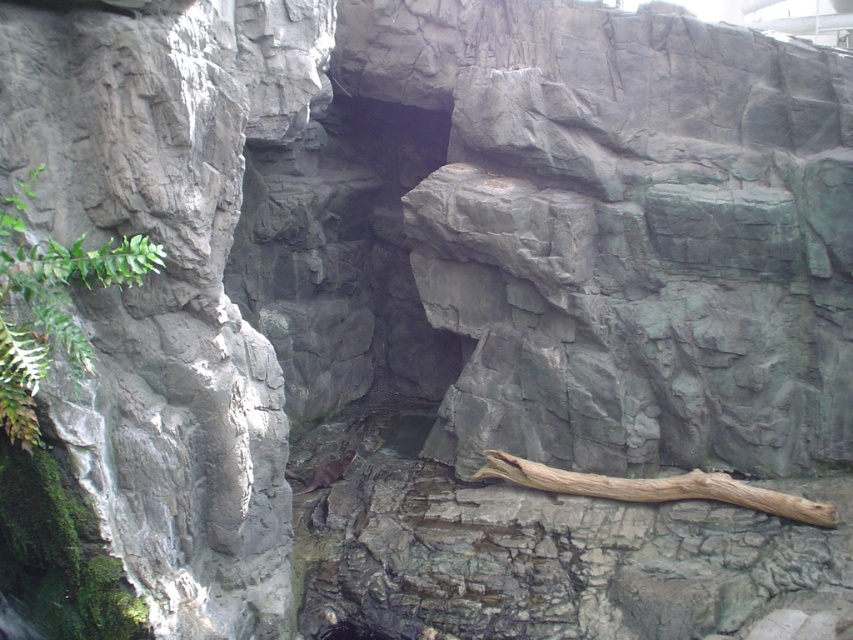
Is brown rough log at lower center bigger than brown furry animal at center?

Yes, brown rough log at lower center is bigger than brown furry animal at center.

Which is more to the left, brown rough log at lower center or brown furry animal at center?

Positioned to the left is brown furry animal at center.

Who is more distant from viewer, [520,474] or [283,472]?

Point [520,474]

I want to click on brown rough log at lower center, so click(x=654, y=486).

Is point (16, 401) positioned behind point (610, 477)?

That is False.

Does green leafy plant at left appear under brown rough log at lower center?

Actually, green leafy plant at left is above brown rough log at lower center.

Identify the location of green leafy plant at left. (50, 305).

Which is more to the left, green leafy plant at left or brown furry animal at center?

green leafy plant at left is more to the left.

In the scene shown: Who is positioned more to the right, green leafy plant at left or brown furry animal at center?

brown furry animal at center is more to the right.

Is point (30, 257) positioned in front of point (335, 470)?

Yes, it is.

At what (x,y) coordinates should I click in order to perform the action: click on green leafy plant at left. Please return your answer as a coordinate pair (x, y). This screenshot has height=640, width=853. Looking at the image, I should click on (50, 305).